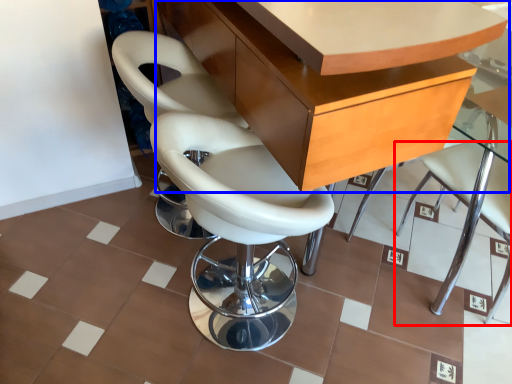
Question: Which object appears closest to the camera in this image, chair (highlighted by a red box) or table (highlighted by a blue box)?

Choices:
 (A) chair
 (B) table

Answer: (B)